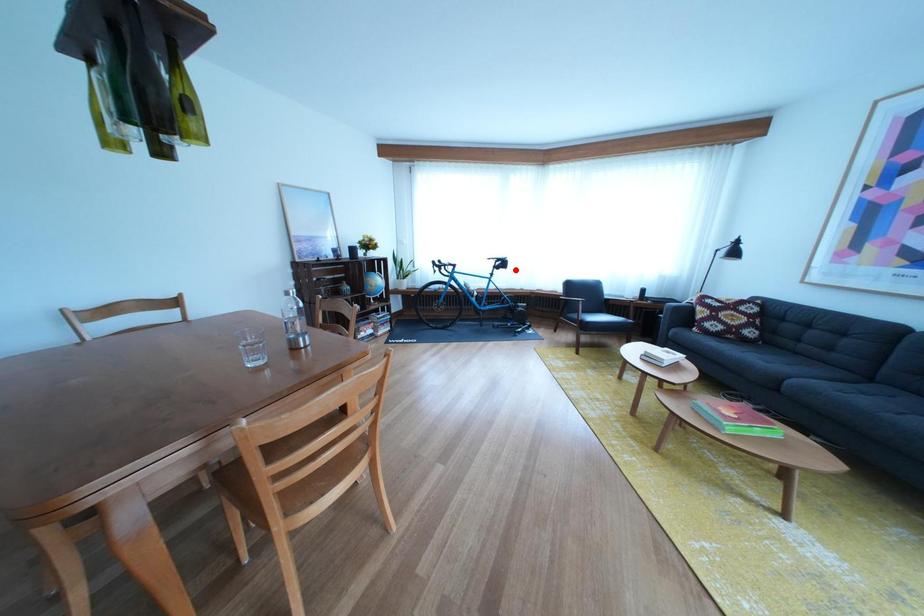
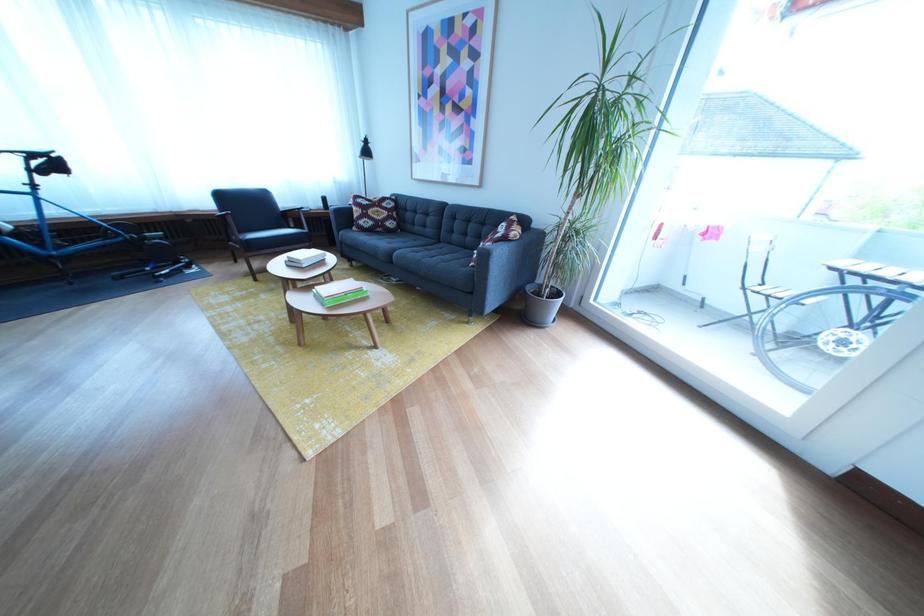
Question: I am providing you with two images of the same scene from different viewpoints. In image1, a red point is highlighted. Considering the same 3D point in image2, which of the following is correct?

Choices:
 (A) It is closer
 (B) It is farther

Answer: (B)